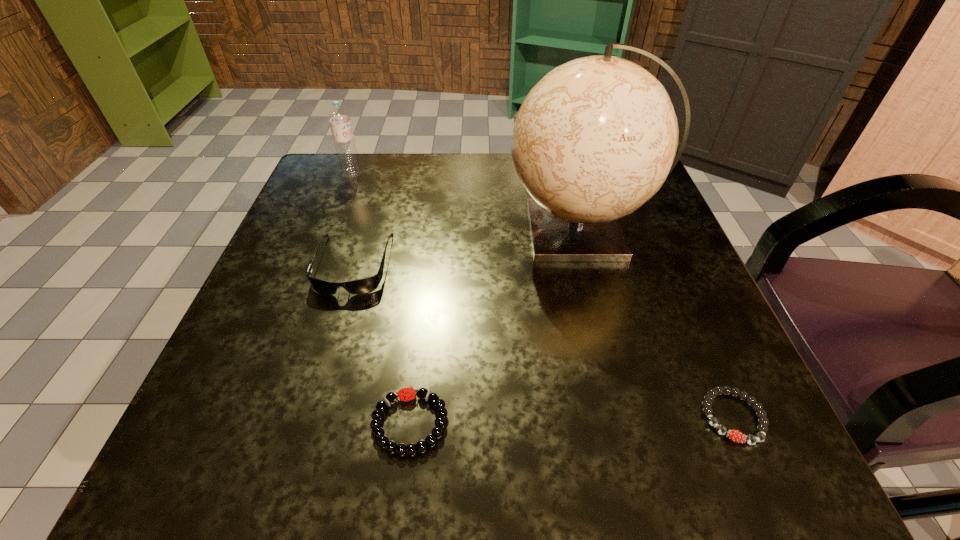
Locate an element on the screen. The image size is (960, 540). globe is located at coordinates click(596, 137).

You are a GUI agent. You are given a task and a screenshot of the screen. Output one action in this format:
    pyautogui.click(x=<x>, y=<y>)
    Task: Click on the farthest object
    
    Given the screenshot: What is the action you would take?
    pyautogui.click(x=339, y=118)

This screenshot has height=540, width=960. Find the location of `water bottle`. water bottle is located at coordinates (339, 118).

This screenshot has height=540, width=960. Find the location of `sunglasses`. sunglasses is located at coordinates (366, 285).

The width and height of the screenshot is (960, 540). In order to click on the second shortest object in this screenshot , I will do `click(378, 433)`.

Find the location of `the left bracelet`. the left bracelet is located at coordinates (378, 433).

I want to click on the shortest object, so click(x=734, y=435).

In order to click on the shorter bracelet in this screenshot , I will do `click(734, 435)`.

In order to click on vacant area situated on the surface of the tallest object showing Europe and Africa in this screenshot , I will do `click(381, 231)`.

Where is `vacant area situated on the surface of the tallest object showing Europe and Africa`? vacant area situated on the surface of the tallest object showing Europe and Africa is located at coordinates (449, 231).